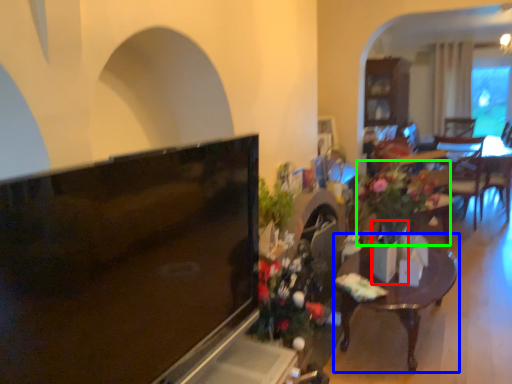
Question: Which object is the closest to the vase (highlighted by a red box)? Choose among these: table (highlighted by a blue box) or houseplant (highlighted by a green box).

Choices:
 (A) table
 (B) houseplant

Answer: (B)